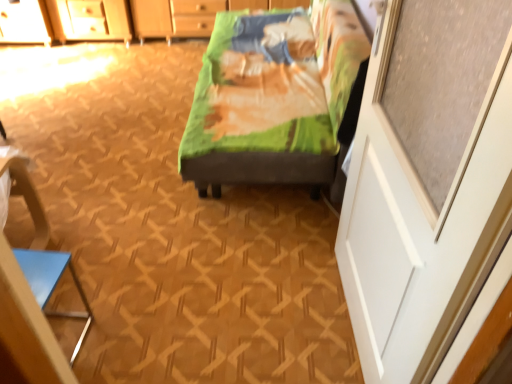
You are a GUI agent. You are given a task and a screenshot of the screen. Output one action in this format:
    pyautogui.click(x=<x>, y=<y>)
    Task: Click on the vacant area that lies between white matte screen door at right and blue glossy triangle at lower left
    The height and width of the screenshot is (384, 512).
    Given the screenshot: What is the action you would take?
    pyautogui.click(x=224, y=319)